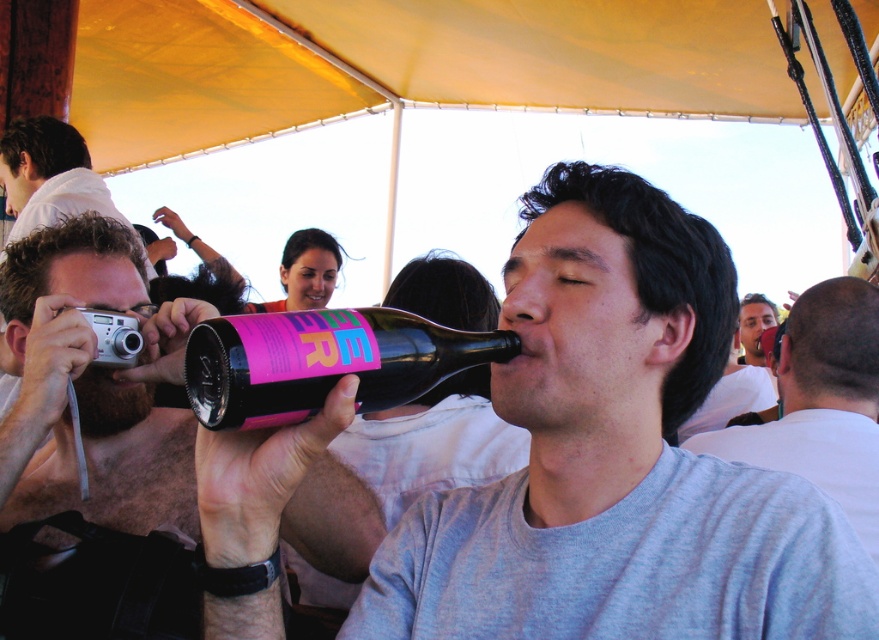
Question: In this image, where is shiny metallic camera at upper left located relative to gray matte shirt at center?

Choices:
 (A) right
 (B) left

Answer: (B)

Question: Does gray matte shirt at center have a greater width compared to smooth white shirt at center?

Choices:
 (A) yes
 (B) no

Answer: (B)

Question: Which of these objects is positioned farthest from the matte black bottle at upper center?

Choices:
 (A) matte black bottle at center
 (B) shiny metallic camera at upper left
 (C) gray matte shirt at center

Answer: (A)

Question: Estimate the real-world distances between objects in this image. Which object is closer to the matte black bottle at upper center?

Choices:
 (A) gray matte shirt at center
 (B) smooth white shirt at center
 (C) black matte bottle at center
 (D) shiny metallic camera at upper left

Answer: (B)

Question: Does black matte bottle at center come behind matte black bottle at upper center?

Choices:
 (A) no
 (B) yes

Answer: (A)

Question: Which of the following is the farthest from the observer?

Choices:
 (A) matte black bottle at center
 (B) gray matte shirt at center
 (C) shiny metallic camera at upper left

Answer: (B)